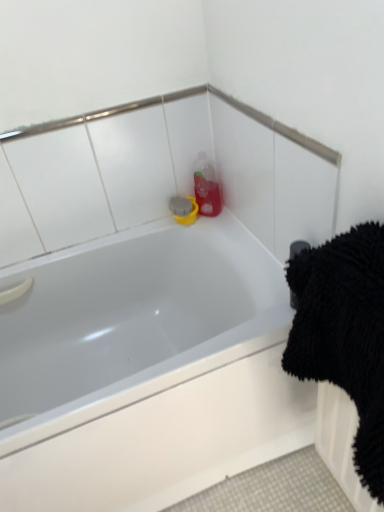
Question: In terms of size, does white glossy bathtub at upper center appear bigger or smaller than black rubber towel bar at upper right?

Choices:
 (A) small
 (B) big

Answer: (B)

Question: Does point (195, 391) appear closer or farther from the camera than point (294, 293)?

Choices:
 (A) closer
 (B) farther

Answer: (B)

Question: Which is nearer to the black rubber towel bar at upper right?

Choices:
 (A) black fluffy bath towel at right
 (B) white glossy bathtub at upper center

Answer: (A)

Question: Considering the real-world distances, which object is farthest from the black fluffy bath towel at right?

Choices:
 (A) white glossy bathtub at upper center
 (B) black rubber towel bar at upper right

Answer: (A)